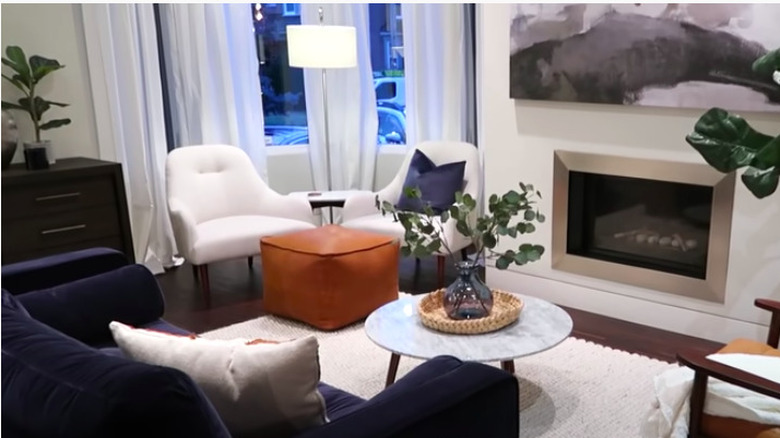
Image resolution: width=780 pixels, height=438 pixels. What are the coordinates of `floor` in the screenshot? It's located at (231, 303).